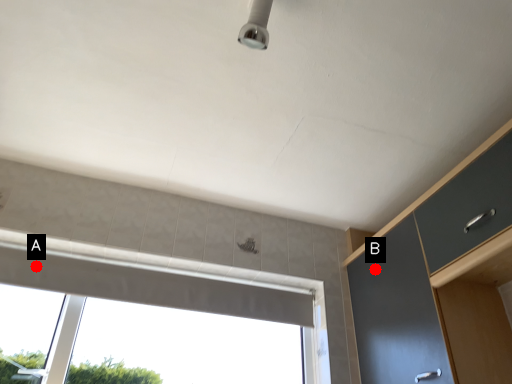
Question: Two points are circled on the image, labeled by A and B beside each circle. Which point is closer to the camera taking this photo?

Choices:
 (A) A is closer
 (B) B is closer

Answer: (A)